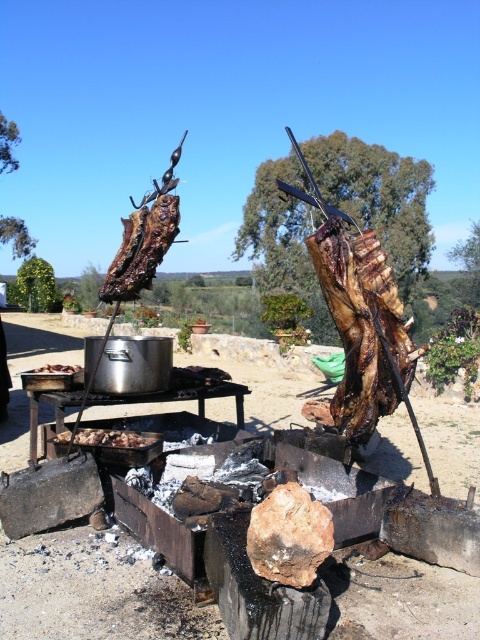
Question: Which point is closer to the camera taking this photo?

Choices:
 (A) (154, 252)
 (B) (67, 369)

Answer: (A)

Question: Is charred wood plank at center in front of brown charred meat at left?

Choices:
 (A) yes
 (B) no

Answer: (A)

Question: Does charred wood plank at center appear over brown charred meat at left?

Choices:
 (A) no
 (B) yes

Answer: (B)

Question: Is charred wood plank at center behind brown charred meat at left?

Choices:
 (A) no
 (B) yes

Answer: (A)

Question: Which object is closer to the camera taking this photo?

Choices:
 (A) charred wood plank at center
 (B) brown charred meat at left
 (C) brown charred meat at lower left

Answer: (C)

Question: Which point is farther from the camera taking this photo?

Choices:
 (A) (81, 429)
 (B) (48, 369)

Answer: (B)